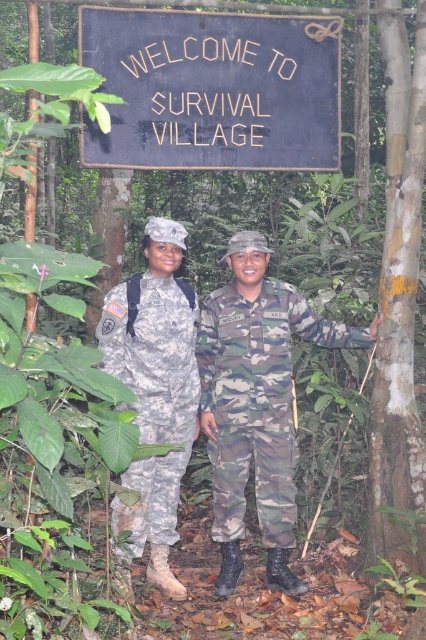
Question: Among these objects, which one is farthest from the camera?

Choices:
 (A) camouflage uniform at center
 (B) camouflage fabric uniform at left
 (C) camo fabric uniform at center
 (D) black wood sign at upper center

Answer: (C)

Question: Can you confirm if camouflage uniform at center is positioned to the left of camo fabric uniform at center?

Choices:
 (A) yes
 (B) no

Answer: (A)

Question: Does camouflage uniform at center appear under camouflage fabric uniform at left?

Choices:
 (A) yes
 (B) no

Answer: (B)

Question: Can you confirm if camo fabric uniform at center is smaller than camouflage fabric uniform at left?

Choices:
 (A) no
 (B) yes

Answer: (B)

Question: Among these points, which one is farthest from the camera?

Choices:
 (A) [161, 324]
 (B) [236, 365]
 (C) [235, 563]
 (D) [152, 152]

Answer: (C)

Question: Which point is farther to the camera?

Choices:
 (A) (210, 304)
 (B) (195, 330)
 (C) (249, 128)

Answer: (A)